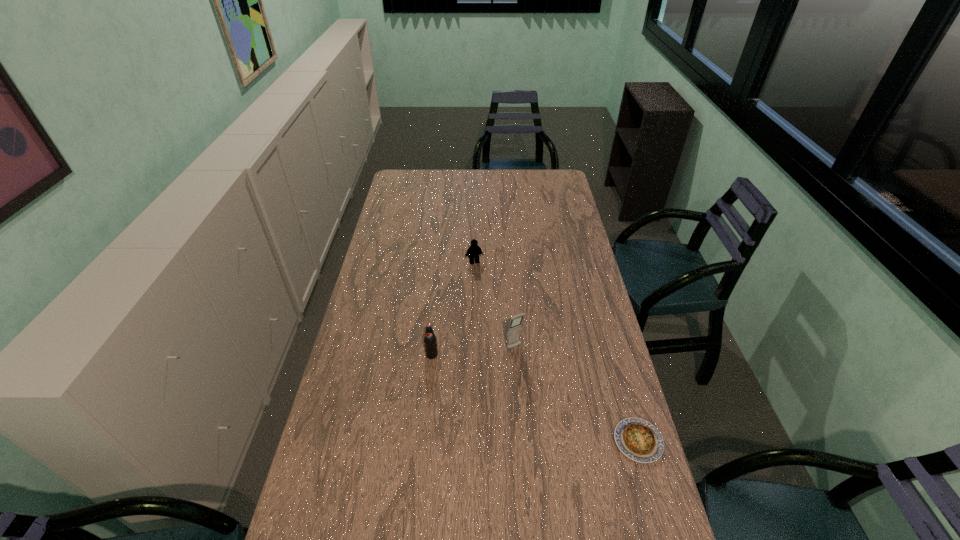
Locate an element on the screen. This screenshot has width=960, height=540. the third shortest object is located at coordinates (430, 341).

The width and height of the screenshot is (960, 540). I want to click on pop, so click(430, 341).

Locate an element on the screen. The image size is (960, 540). quiche is located at coordinates (639, 440).

Identify the location of the shortest object. This screenshot has height=540, width=960. (639, 440).

Where is `the third object from left to right`? The height and width of the screenshot is (540, 960). the third object from left to right is located at coordinates (514, 329).

Locate an element on the screen. This screenshot has height=540, width=960. the second object from left to right is located at coordinates (474, 250).

Locate an element on the screen. The image size is (960, 540). the third tallest object is located at coordinates (474, 250).

Locate an element on the screen. The height and width of the screenshot is (540, 960). free location located on the front label of the leftmost object is located at coordinates (425, 421).

Find the location of a particular element. free spot located 0.250m on the left of the nearest object is located at coordinates (525, 441).

At what (x,y) coordinates should I click in order to perform the action: click on free spot located on the front-facing side of the third object from left to right. Please return your answer as a coordinate pair (x, y). This screenshot has width=960, height=540. Looking at the image, I should click on [x=564, y=417].